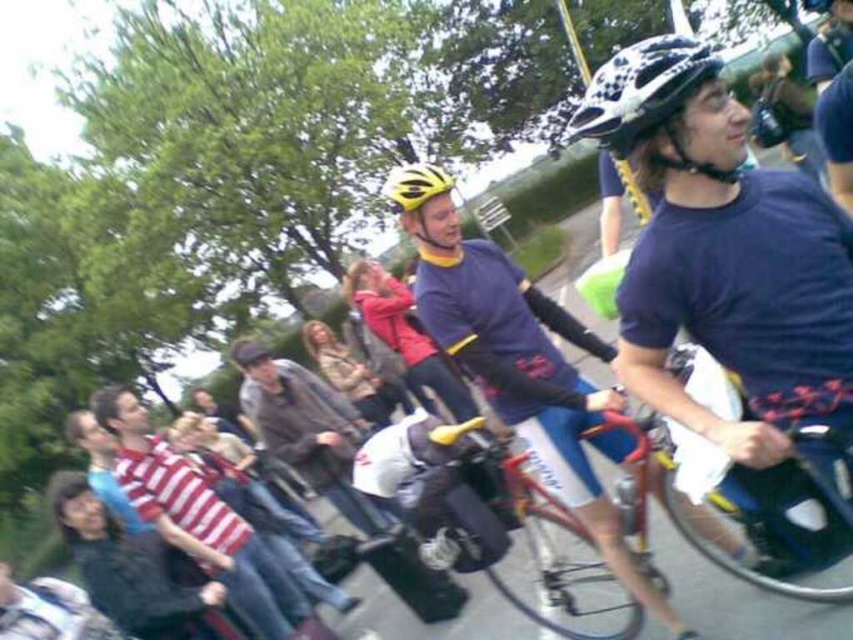
You are a photographer at the event and want to capture a photo of the dark brown leather jacket at center. The jacket is at coordinates point (306, 429). Your camera has a zoom lens that can focus on objects within a radius of 0.2 units. Will the jacket be in focus?

The dark brown leather jacket at center is marked by point (306, 429). Since the camera can focus within a radius of 0.2 units, the distance from the center to the jacket is sqrt? Wait, maybe better to compute distance between point and center? Hmm, the coordinates are given as a point, so the center would be at 0.5,0.5. The distance between 0.673,0.360 and 0.5,0.5 is sqrt? Let me calculate. The x difference is 0.173, y difference is 0.14. Squared terms are 0.0299 and 0.0196. Sum is 0.0495. Square root is

You are a photographer trying to capture a clear photo of both the shiny metallic bicycle at center and the yellow matte bicycle helmet at center. Since you want to focus on the bicycle, you need to adjust your camera settings to ensure the helmet doesn not overpower the bicycle in size. Based on their sizes, which object should you prioritize framing closer to the camera?

The shiny metallic bicycle at center is wider than the yellow matte bicycle helmet at center. To prevent the helmet from overpowering the bicycle in the photo, you should frame the bicycle closer to the camera since it is larger and requires more focus.

You are a photographer trying to capture a photo of both the shiny metallic bicycle at center and the yellow matte bicycle helmet at center. Since you can only focus on one object at a time, which object should you focus on first to ensure the other is still in the frame?

The shiny metallic bicycle at center is to the right of yellow matte bicycle helmet at center, so you should focus on the yellow matte bicycle helmet at center first to ensure the shiny metallic bicycle at center remains in the frame to its right.